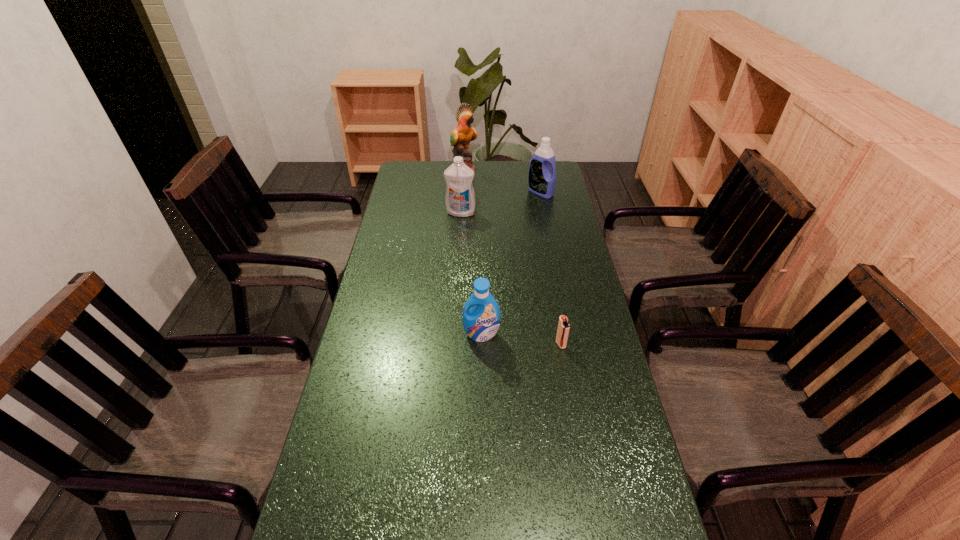
Where is `free spot located on the back of the third nearest object`? free spot located on the back of the third nearest object is located at coordinates (464, 165).

Where is `vacant region located 0.160m on the front-facing side of the fourth tallest object`? This screenshot has height=540, width=960. vacant region located 0.160m on the front-facing side of the fourth tallest object is located at coordinates [x=482, y=389].

Identify the location of vacant space located 0.260m on the front of the igniter. (576, 435).

The width and height of the screenshot is (960, 540). What are the coordinates of `parrot that is at the far edge` in the screenshot? It's located at (463, 133).

The width and height of the screenshot is (960, 540). In order to click on detergent that is at the far edge in this screenshot , I will do `click(542, 179)`.

The height and width of the screenshot is (540, 960). What are the coordinates of `detergent present at the right edge` in the screenshot? It's located at (542, 179).

Where is `igniter present at the right edge`? Image resolution: width=960 pixels, height=540 pixels. igniter present at the right edge is located at coordinates (563, 328).

This screenshot has height=540, width=960. What are the coordinates of `object located in the far right corner section of the desktop` in the screenshot? It's located at point(542,179).

At what (x,y) coordinates should I click in order to perform the action: click on vacant space at the far edge. Please return your answer as a coordinate pair (x, y). Looking at the image, I should click on (481, 165).

Locate an element on the screen. The width and height of the screenshot is (960, 540). vacant region at the left edge of the desktop is located at coordinates (399, 212).